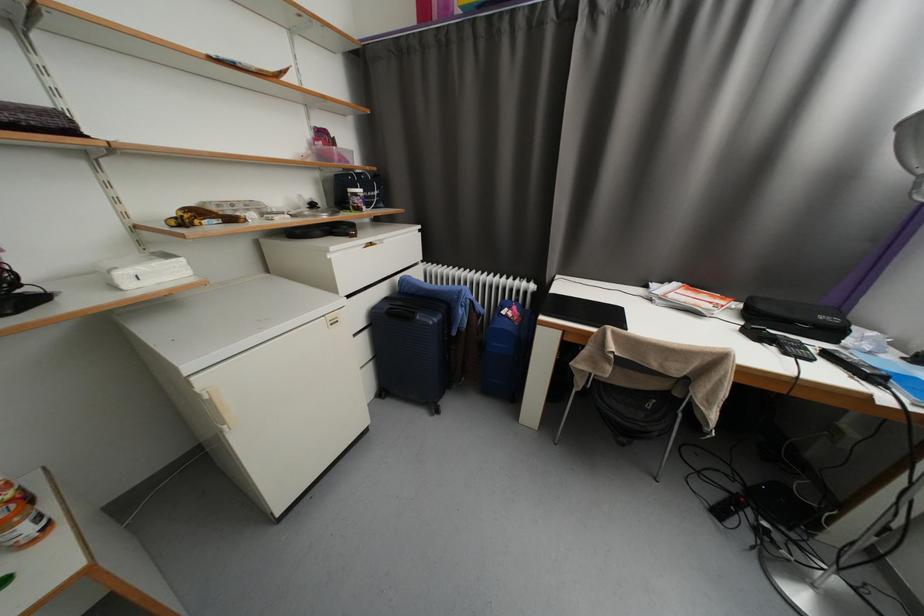
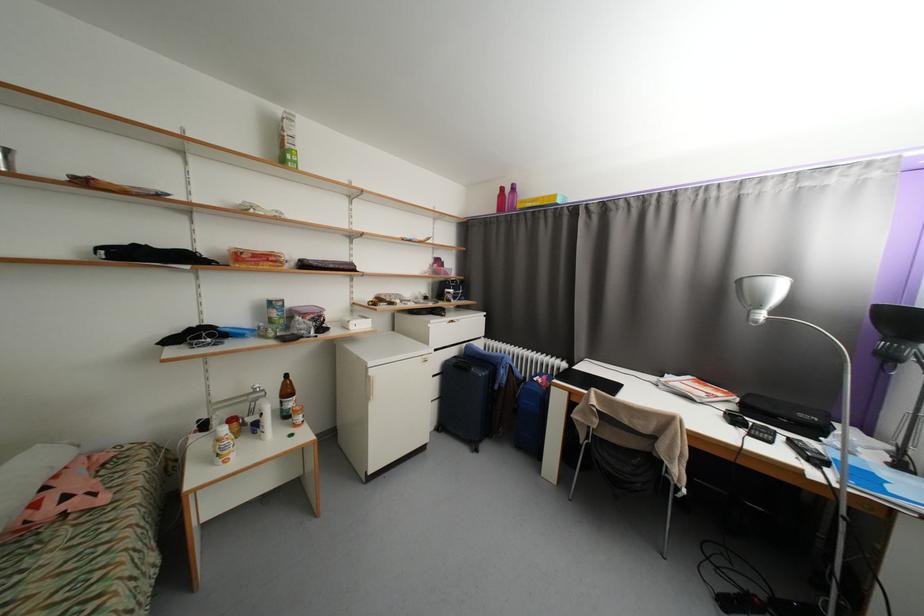
Find the pixel in the second image that matches (x=792, y=355) in the first image.

(757, 436)